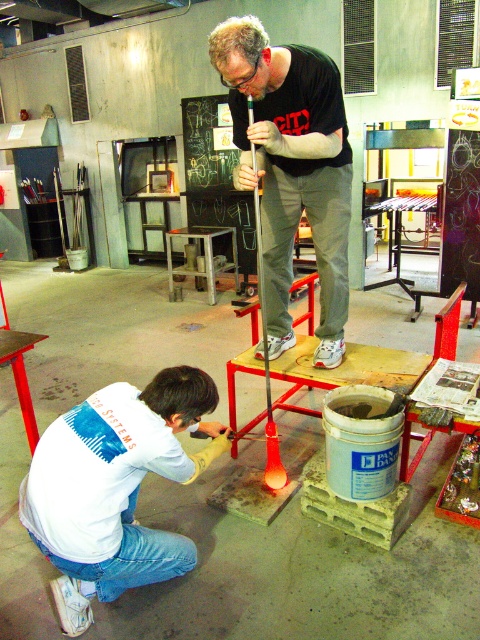
You are a visitor in the glassblowing workshop and want to take a photo of the matte black shirt at center. Where should you position yourself to capture the best angle?

The matte black shirt at center is located at point (291,168), so you should position yourself directly in front of that coordinate to capture the best angle.

You are a visitor in the glassblowing workshop and want to take a photo of the white matte shirt at lower left and the metallic stool at center. Which object should you focus on first if you want to capture both in the same frame?

You should focus on the white matte shirt at lower left first because it is closer to you than the metallic stool at center, ensuring both are in focus when using depth of field.